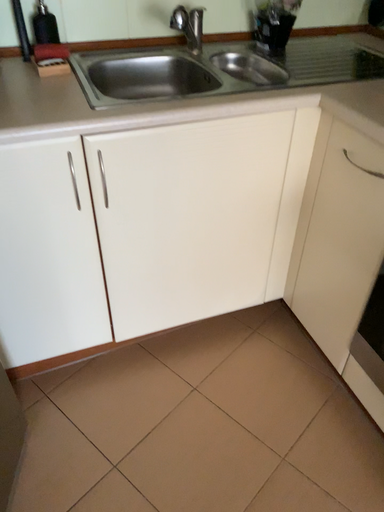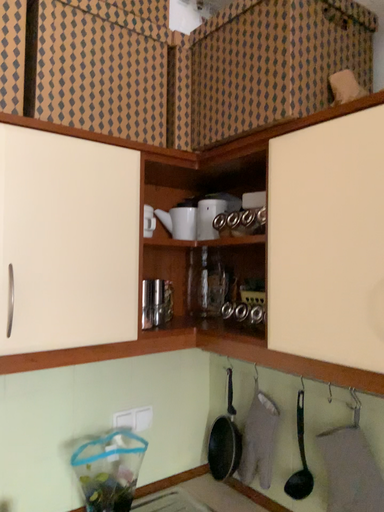
Question: Which way did the camera rotate in the video?

Choices:
 (A) rotated left
 (B) rotated right

Answer: (B)